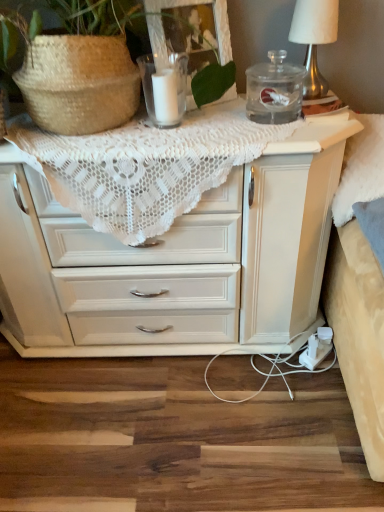
Question: Does transparent glass jar at upper right contain white lace doily at upper center?

Choices:
 (A) yes
 (B) no

Answer: (B)

Question: From the image's perspective, is transparent glass jar at upper right under white lace doily at upper center?

Choices:
 (A) yes
 (B) no

Answer: (B)

Question: Is transparent glass jar at upper right oriented away from white lace doily at upper center?

Choices:
 (A) no
 (B) yes

Answer: (A)

Question: Is transparent glass jar at upper right taller than white lace doily at upper center?

Choices:
 (A) no
 (B) yes

Answer: (A)

Question: Can you confirm if transparent glass jar at upper right is shorter than white lace doily at upper center?

Choices:
 (A) yes
 (B) no

Answer: (A)

Question: From a real-world perspective, relative to clear glass candle at upper center, is white lace doily at upper center vertically above or below?

Choices:
 (A) above
 (B) below

Answer: (B)

Question: Which is correct: white lace doily at upper center is inside clear glass candle at upper center, or outside of it?

Choices:
 (A) outside
 (B) inside

Answer: (A)

Question: Is white lace doily at upper center bigger or smaller than clear glass candle at upper center?

Choices:
 (A) big
 (B) small

Answer: (A)

Question: In terms of width, does white lace doily at upper center look wider or thinner when compared to clear glass candle at upper center?

Choices:
 (A) wide
 (B) thin

Answer: (A)

Question: In terms of size, does clear glass candle at upper center appear bigger or smaller than white lace doily at upper center?

Choices:
 (A) big
 (B) small

Answer: (B)

Question: In the image, is clear glass candle at upper center positioned in front of or behind white lace doily at upper center?

Choices:
 (A) behind
 (B) front

Answer: (A)

Question: From the image's perspective, is clear glass candle at upper center above or below white lace doily at upper center?

Choices:
 (A) below
 (B) above

Answer: (B)

Question: Is point (162, 97) closer or farther from the camera than point (208, 305)?

Choices:
 (A) closer
 (B) farther

Answer: (A)

Question: Is clear glass candle at upper center spatially inside transparent glass jar at upper right, or outside of it?

Choices:
 (A) inside
 (B) outside

Answer: (B)

Question: In terms of size, does clear glass candle at upper center appear bigger or smaller than transparent glass jar at upper right?

Choices:
 (A) small
 (B) big

Answer: (A)